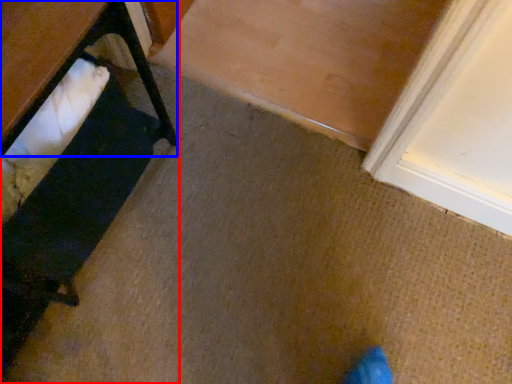
Question: Which point is further to the camera, furniture (highlighted by a red box) or table (highlighted by a blue box)?

Choices:
 (A) furniture
 (B) table

Answer: (A)